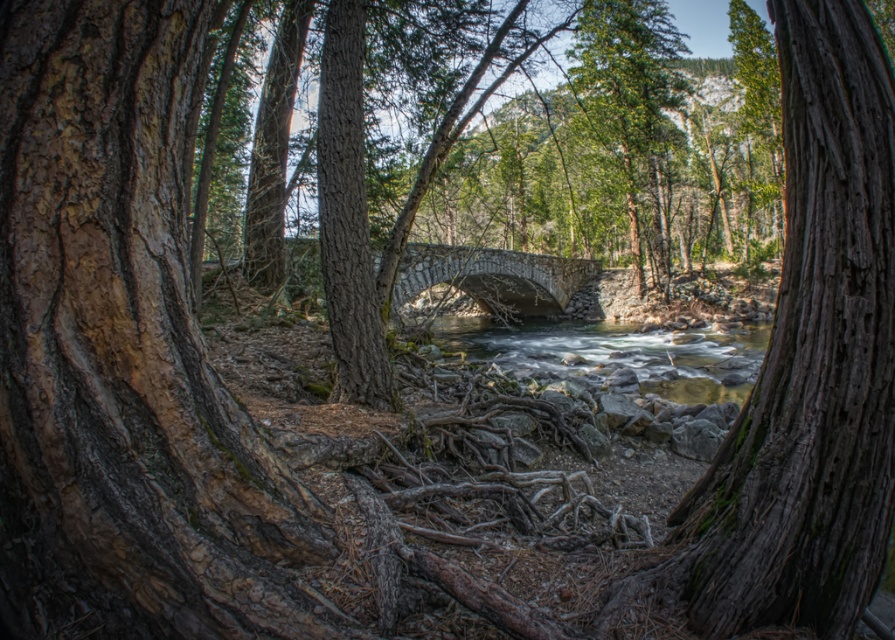
Does smooth brown tree trunk at center have a lesser height compared to stone bridge at center?

Indeed, smooth brown tree trunk at center has a lesser height compared to stone bridge at center.

Is smooth brown tree trunk at center to the right of stone bridge at center from the viewer's perspective?

No, smooth brown tree trunk at center is not to the right of stone bridge at center.

Is point (351, 32) farther from viewer compared to point (480, 269)?

No.

You are a GUI agent. You are given a task and a screenshot of the screen. Output one action in this format:
    pyautogui.click(x=<x>, y=<y>)
    Task: Click on the smooth brown tree trunk at center
    Image resolution: width=895 pixels, height=640 pixels.
    Given the screenshot: What is the action you would take?
    pyautogui.click(x=348, y=216)

How far apart are clear water at center and green matte tree at upper center?

They are 30.44 feet apart.

Can you confirm if clear water at center is positioned to the right of green matte tree at upper center?

Incorrect, clear water at center is not on the right side of green matte tree at upper center.

Is point (446, 321) in front of point (578, 64)?

Yes, point (446, 321) is closer to viewer.

Find the location of a particular element. The image size is (895, 640). clear water at center is located at coordinates (618, 353).

Can you confirm if smooth brown tree trunk at center is taller than green matte tree at upper center?

No, smooth brown tree trunk at center is not taller than green matte tree at upper center.

Who is more distant from viewer, (334,77) or (626,184)?

Point (626,184)

Locate an element on the screen. smooth brown tree trunk at center is located at coordinates (348, 216).